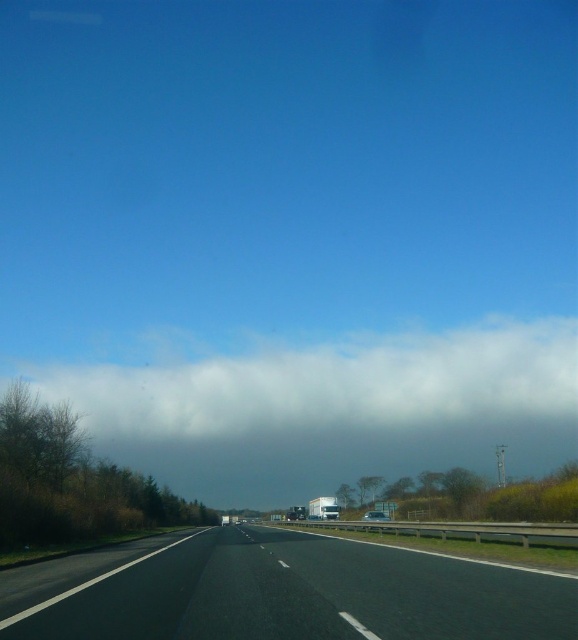
Question: Is black asphalt highway at center to the left of silver metallic van at center from the viewer's perspective?

Choices:
 (A) yes
 (B) no

Answer: (A)

Question: Among these points, which one is nearest to the camera?

Choices:
 (A) (320, 502)
 (B) (384, 513)

Answer: (A)

Question: Which object appears farthest from the camera in this image?

Choices:
 (A) metallic silver trailer truck at center
 (B) white fluffy cloud at upper center

Answer: (B)

Question: Does metallic silver trailer truck at center come in front of silver metallic van at center?

Choices:
 (A) no
 (B) yes

Answer: (A)

Question: Which point is closer to the camera?

Choices:
 (A) metallic silver trailer truck at center
 (B) silver metallic van at center
 (C) black asphalt highway at center
 (D) white fluffy cloud at upper center

Answer: (C)

Question: Can you confirm if black asphalt highway at center is positioned below metallic silver trailer truck at center?

Choices:
 (A) yes
 (B) no

Answer: (B)